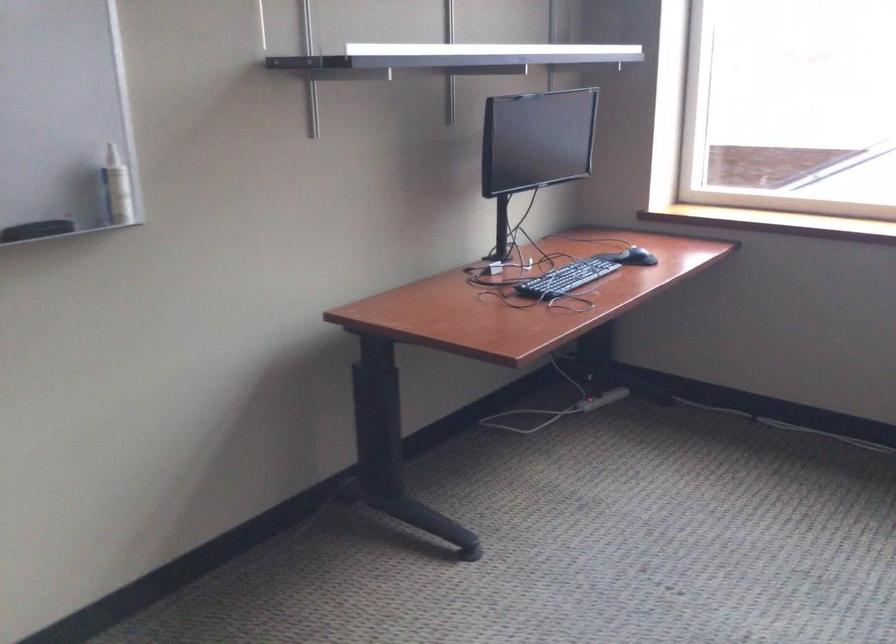
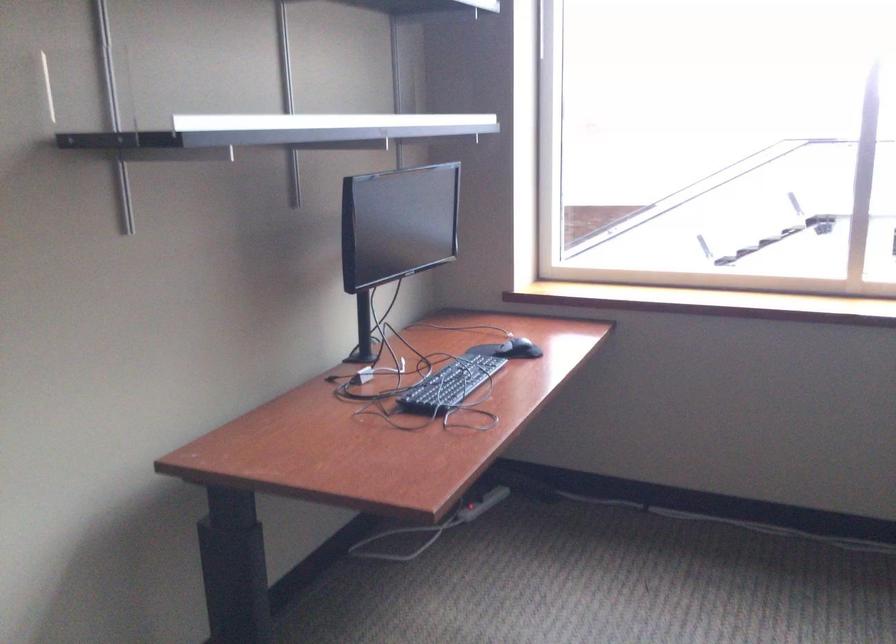
Question: The images are taken continuously from a first-person perspective. In which direction is your viewpoint rotating?

Choices:
 (A) Left
 (B) Right
 (C) Up
 (D) Down

Answer: (B)